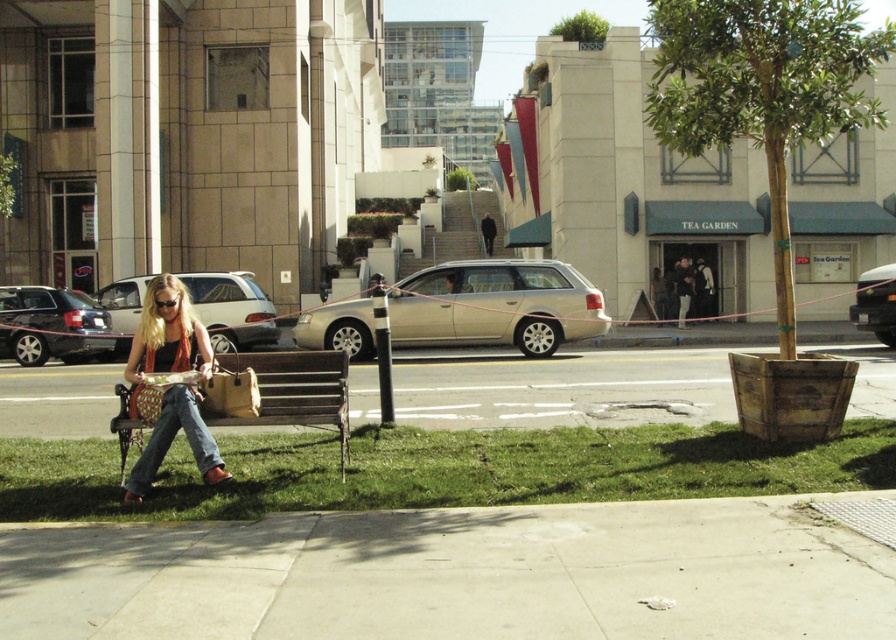
Is green grass at lower center thinner than satin gold station wagon at center?

Indeed, green grass at lower center has a lesser width compared to satin gold station wagon at center.

Who is more distant from viewer, (50, 456) or (564, 317)?

Point (564, 317)

I want to click on green grass at lower center, so click(x=440, y=468).

Does point (475, 310) lie behind point (889, 284)?

No, it is not.

The height and width of the screenshot is (640, 896). Identify the location of satin gold station wagon at center. (496, 305).

Who is positioned more to the right, denim jeans at lower left or metallic silver van at center?

metallic silver van at center

Can you confirm if denim jeans at lower left is thinner than metallic silver van at center?

Incorrect, denim jeans at lower left's width is not less than metallic silver van at center's.

Is point (212, 460) farther from viewer compared to point (881, 300)?

No, (212, 460) is closer to viewer.

What are the coordinates of `denim jeans at lower left` in the screenshot? It's located at (169, 385).